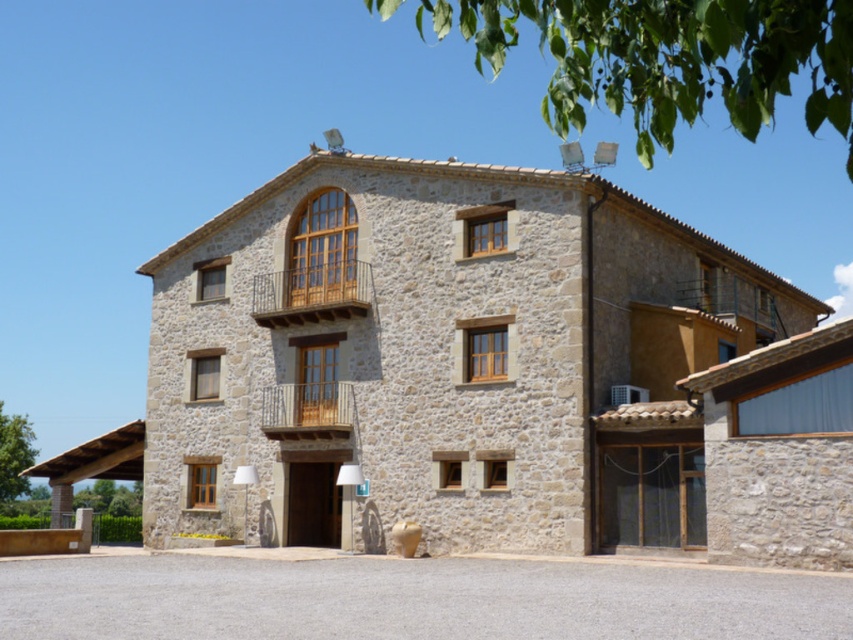
Question: Is wooden at upper center bigger than wooden at center?

Choices:
 (A) no
 (B) yes

Answer: (B)

Question: Can you confirm if wooden at upper center is thinner than wooden at center?

Choices:
 (A) no
 (B) yes

Answer: (A)

Question: Which of the following is the farthest from the observer?

Choices:
 (A) wooden at upper center
 (B) wooden at center

Answer: (A)

Question: Can you confirm if wooden at upper center is positioned above wooden at center?

Choices:
 (A) no
 (B) yes

Answer: (B)